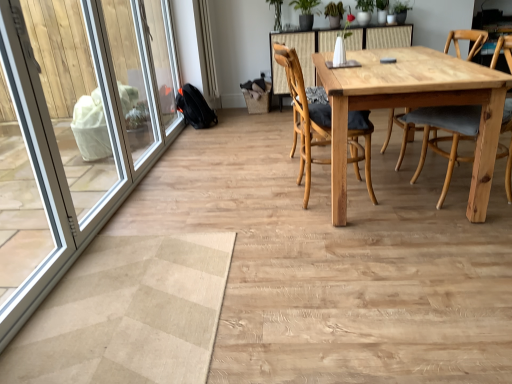
Find the location of a particular element. vacant space in front of wooden chair at center, which is the first chair from left to right is located at coordinates (340, 226).